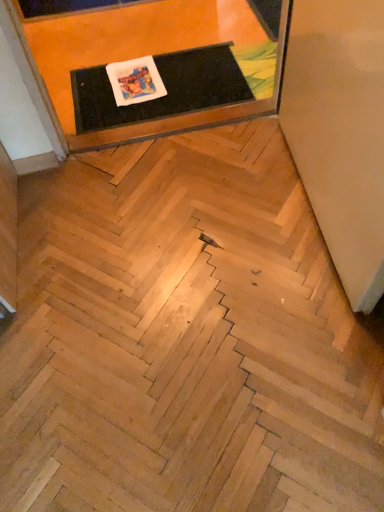
Question: From a real-world perspective, is black rubber mat at upper center on matte black mat at upper center?

Choices:
 (A) yes
 (B) no

Answer: (B)

Question: Is matte black mat at upper center a part of black rubber mat at upper center?

Choices:
 (A) no
 (B) yes

Answer: (A)

Question: Is black rubber mat at upper center next to matte black mat at upper center?

Choices:
 (A) no
 (B) yes

Answer: (A)

Question: From a real-world perspective, is black rubber mat at upper center below matte black mat at upper center?

Choices:
 (A) yes
 (B) no

Answer: (A)

Question: From the image's perspective, is black rubber mat at upper center under matte black mat at upper center?

Choices:
 (A) no
 (B) yes

Answer: (B)

Question: Can you confirm if black rubber mat at upper center is shorter than matte black mat at upper center?

Choices:
 (A) yes
 (B) no

Answer: (A)

Question: Can you confirm if matte black mat at upper center is bigger than black rubber mat at upper center?

Choices:
 (A) no
 (B) yes

Answer: (B)

Question: Considering the relative sizes of matte black mat at upper center and black rubber mat at upper center in the image provided, is matte black mat at upper center wider than black rubber mat at upper center?

Choices:
 (A) yes
 (B) no

Answer: (A)

Question: From the image's perspective, is matte black mat at upper center under black rubber mat at upper center?

Choices:
 (A) yes
 (B) no

Answer: (B)

Question: From a real-world perspective, is matte black mat at upper center on top of black rubber mat at upper center?

Choices:
 (A) no
 (B) yes

Answer: (B)

Question: Is matte black mat at upper center not within black rubber mat at upper center?

Choices:
 (A) no
 (B) yes

Answer: (B)

Question: Is matte black mat at upper center at the right side of black rubber mat at upper center?

Choices:
 (A) no
 (B) yes

Answer: (A)

Question: From a real-world perspective, relative to black rubber mat at upper center, is matte black mat at upper center vertically above or below?

Choices:
 (A) below
 (B) above

Answer: (B)